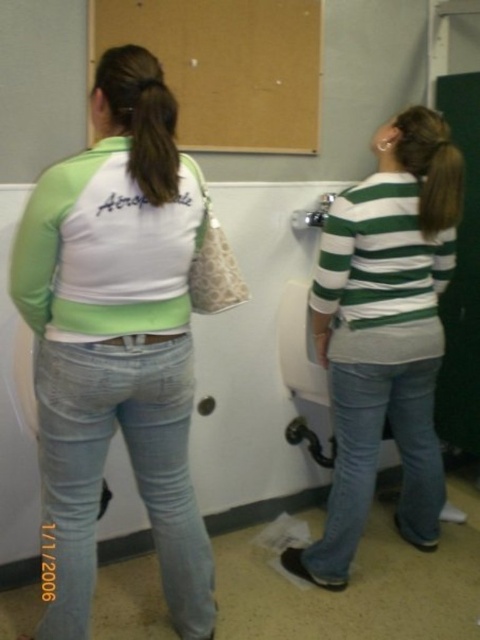
You are a photographer trying to capture both the brown silky hair at upper left and the brown hair at upper center in the same frame. Given that the camera can only focus on objects within a 10 cm width difference, will both fit in the frame?

The brown silky hair at upper left is narrower than the brown hair at upper center. Since the camera can handle up to a 10 cm width difference, and the difference between them is less than that, both can fit in the frame.

You are trying to determine the relative sizes of two items in the restroom scene. Which object is bigger between the light blue denim jeans at center and the brown silky hair at upper left?

The light blue denim jeans at center has a larger size compared to the brown silky hair at upper left, so the light blue denim jeans at center is bigger.

You are a photographer taking a picture of the two people in the restroom. You notice the brown silky hair at upper left and the brown hair at upper center. Which hair should you focus on first if you want to capture the one that is higher in the frame?

The brown silky hair at upper left is located above the brown hair at upper center, so you should focus on the brown silky hair at upper left first to capture the higher one in the frame.